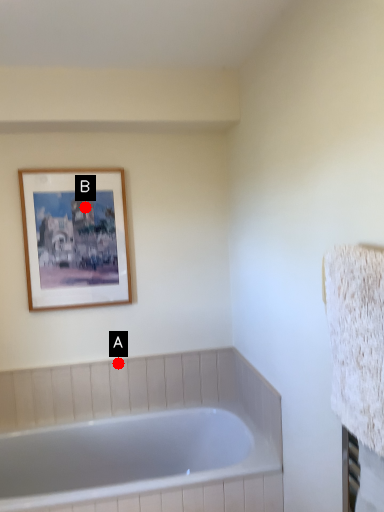
Question: Two points are circled on the image, labeled by A and B beside each circle. Among these points, which one is nearest to the camera?

Choices:
 (A) A is closer
 (B) B is closer

Answer: (B)